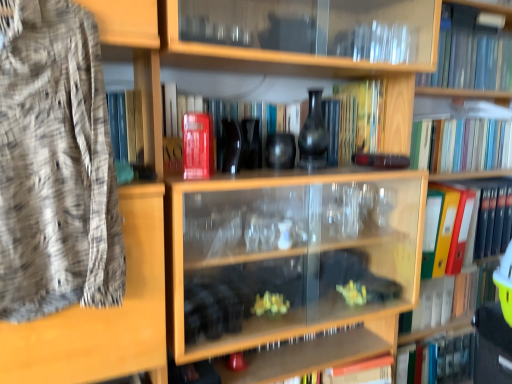
Question: Is transparent glass bookcase at upper center surrounding red matte book at upper center, the third book from the bottom?

Choices:
 (A) no
 (B) yes

Answer: (A)

Question: Could you tell me if transparent glass bookcase at upper center is facing red matte book at upper center, the third book from the bottom?

Choices:
 (A) no
 (B) yes

Answer: (A)

Question: From a real-world perspective, is transparent glass bookcase at upper center positioned over red matte book at upper center, which is counted as the 5th book, starting from the top, based on gravity?

Choices:
 (A) no
 (B) yes

Answer: (A)

Question: From a real-world perspective, is transparent glass bookcase at upper center located beneath red matte book at upper center, the third book from the bottom?

Choices:
 (A) no
 (B) yes

Answer: (B)

Question: Would you say transparent glass bookcase at upper center is outside red matte book at upper center, which is counted as the 5th book, starting from the top?

Choices:
 (A) no
 (B) yes

Answer: (B)

Question: From the image's perspective, is transparent glass bookcase at upper center under red matte book at upper center, which is counted as the 5th book, starting from the top?

Choices:
 (A) no
 (B) yes

Answer: (B)

Question: Could transparent glass cabinet at lower center be considered to be inside woven fabric shirt at left?

Choices:
 (A) yes
 (B) no

Answer: (B)

Question: Can you confirm if woven fabric shirt at left is bigger than transparent glass cabinet at lower center?

Choices:
 (A) no
 (B) yes

Answer: (B)

Question: Considering the relative positions of woven fabric shirt at left and transparent glass cabinet at lower center in the image provided, is woven fabric shirt at left in front of transparent glass cabinet at lower center?

Choices:
 (A) no
 (B) yes

Answer: (B)

Question: From the image's perspective, is woven fabric shirt at left over transparent glass cabinet at lower center?

Choices:
 (A) no
 (B) yes

Answer: (B)

Question: Is woven fabric shirt at left positioned beyond the bounds of transparent glass cabinet at lower center?

Choices:
 (A) yes
 (B) no

Answer: (A)

Question: Can you confirm if woven fabric shirt at left is wider than transparent glass cabinet at lower center?

Choices:
 (A) yes
 (B) no

Answer: (A)

Question: Can you confirm if matte black vase at center is taller than transparent glass book at upper right, the 1th book positioned from the top?

Choices:
 (A) yes
 (B) no

Answer: (A)